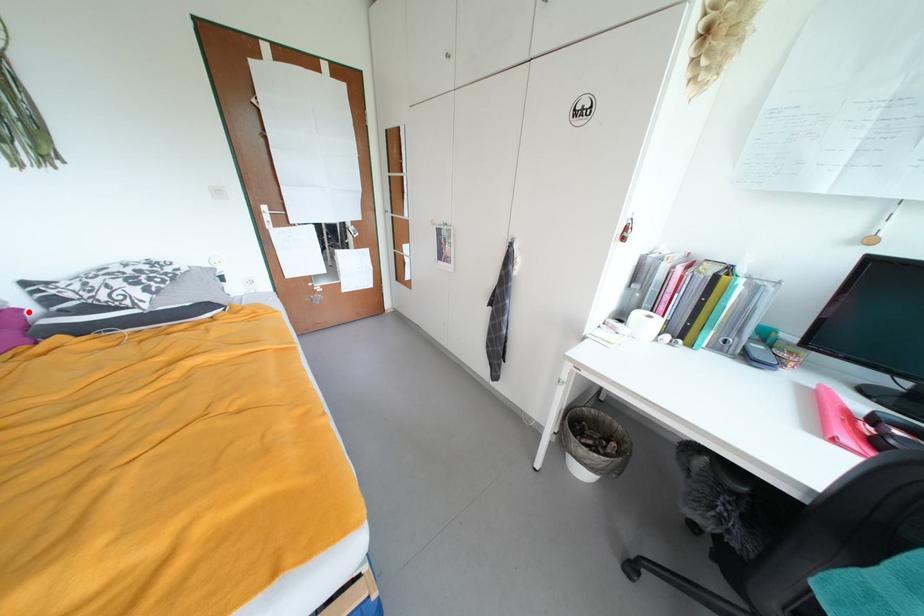
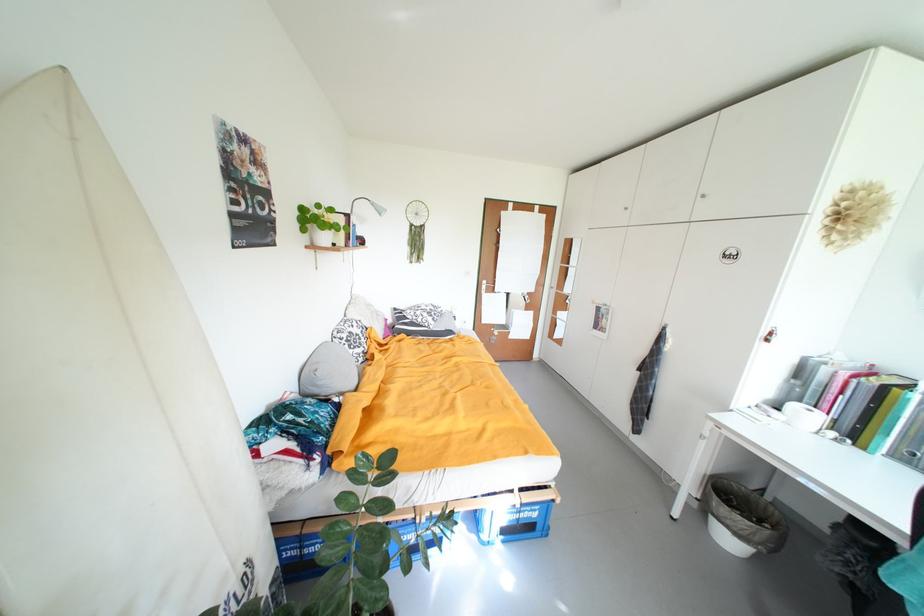
Question: I am providing you with two images of the same scene from different viewpoints. A red point is marked on the first image. At the location where the point appears in image 1, is it still visible in image 2?

Choices:
 (A) Yes
 (B) No

Answer: (A)